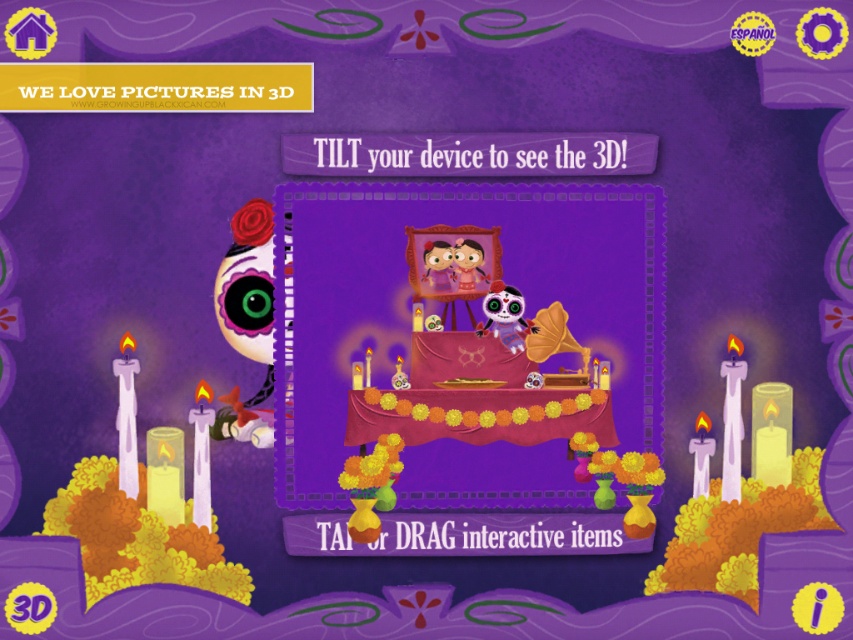
Question: Among these points, which one is farthest from the camera?

Choices:
 (A) click(x=502, y=300)
 (B) click(x=651, y=188)

Answer: (A)

Question: Which point is farther to the camera?

Choices:
 (A) matte plastic skull at center
 (B) matte pink tablecloth at center

Answer: (A)

Question: Can you confirm if matte pink tablecloth at center is bigger than matte plastic skull at center?

Choices:
 (A) no
 (B) yes

Answer: (B)

Question: Which point appears closest to the camera in this image?

Choices:
 (A) (509, 330)
 (B) (616, 384)

Answer: (B)

Question: Is matte pink tablecloth at center to the right of matte plastic skull at center from the viewer's perspective?

Choices:
 (A) no
 (B) yes

Answer: (A)

Question: Does matte pink tablecloth at center appear on the right side of matte plastic skull at center?

Choices:
 (A) yes
 (B) no

Answer: (B)